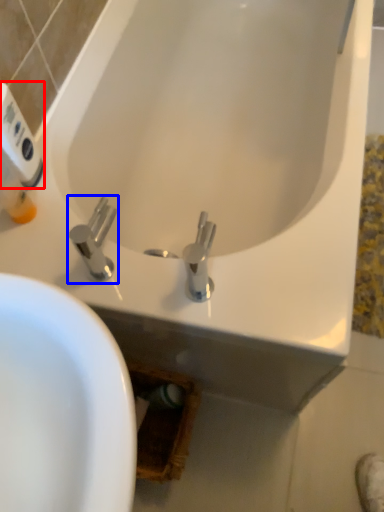
Question: Which point is closer to the camera, hand dryer (highlighted by a red box) or tap (highlighted by a blue box)?

Choices:
 (A) hand dryer
 (B) tap

Answer: (B)